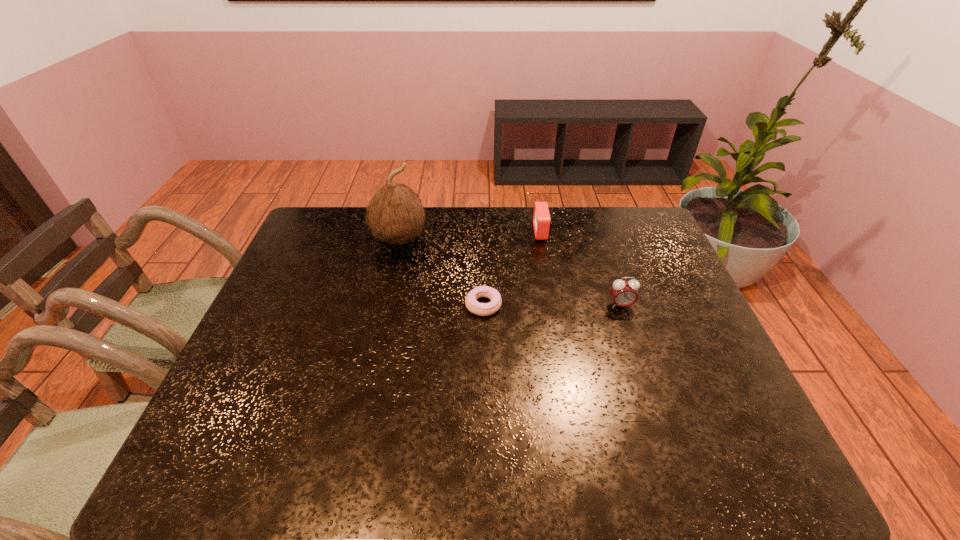
You are a GUI agent. You are given a task and a screenshot of the screen. Output one action in this format:
    pyautogui.click(x=<x>, y=<y>)
    Task: Click on the leftmost object
    This screenshot has height=540, width=960.
    Given the screenshot: What is the action you would take?
    pyautogui.click(x=395, y=213)

This screenshot has height=540, width=960. What are the coordinates of `the tallest object` in the screenshot? It's located at point(395,213).

Identify the location of the nearer alarm clock. This screenshot has width=960, height=540. (623, 293).

You are a GUI agent. You are given a task and a screenshot of the screen. Output one action in this format:
    pyautogui.click(x=<x>, y=<y>)
    Task: Click on the rightmost object
    The width and height of the screenshot is (960, 540).
    Given the screenshot: What is the action you would take?
    pyautogui.click(x=623, y=293)

Locate an element on the screen. the third tallest object is located at coordinates (542, 223).

Identify the location of the left alarm clock. Image resolution: width=960 pixels, height=540 pixels. (542, 223).

Find the location of a particular element. The width and height of the screenshot is (960, 540). the shortest object is located at coordinates (482, 309).

Identify the location of the second object from left to right. The image size is (960, 540). coord(482,309).

In order to click on vacant space located 0.230m on the surface of the leftmost object in this screenshot , I will do `click(384, 310)`.

This screenshot has height=540, width=960. Find the location of `vacant space situated on the clock face of the rightmost object`. vacant space situated on the clock face of the rightmost object is located at coordinates (646, 381).